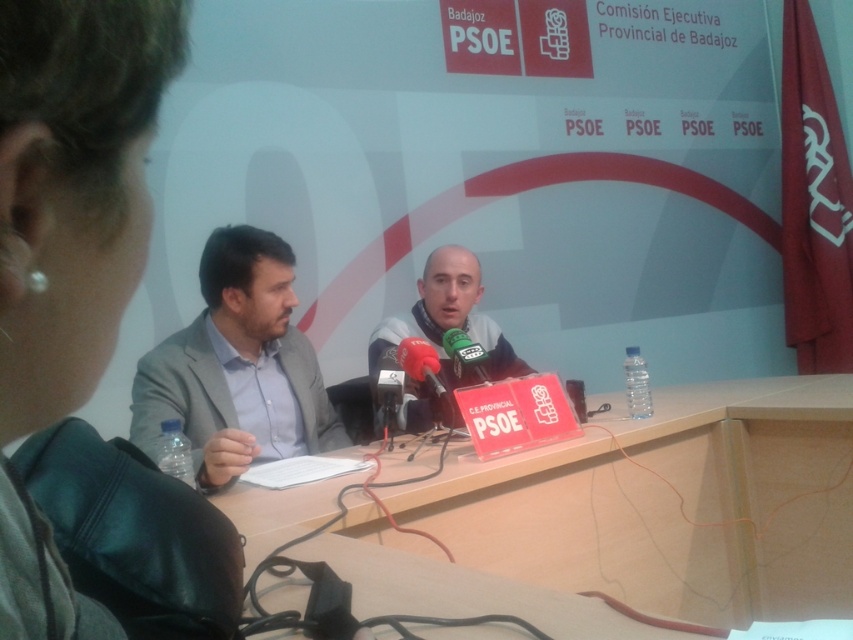
Looking at this image, you are a photographer standing at the camera position. You want to take a photo of the point at coordinates (334, 445) in the scene. The camera has a focal length of 50mm. What is the approximate distance in feet between the camera and the point?

The point at coordinates (334, 445) is 7.02 feet away from the camera, so the distance is approximately 7.02 feet.

From the picture: You are a photographer at the event and need to capture a photo where both the gray fabric suit at left and the metallic red microphone at center are clearly visible. Given their sizes, which object will appear larger in the photo?

The gray fabric suit at left will appear larger in the photo since it has a greater height compared to the metallic red microphone at center.